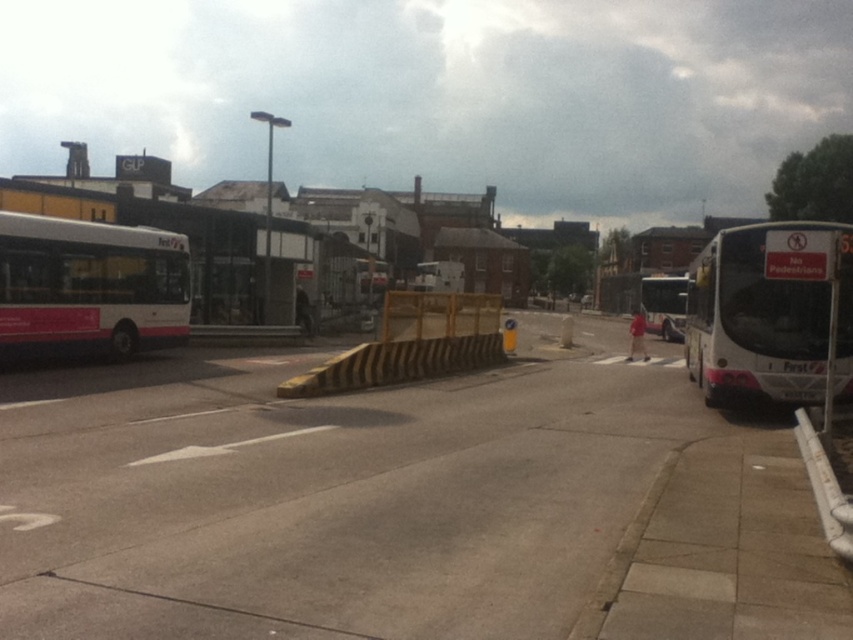
Between white glossy bus at right and white plastic curb at lower right, which one appears on the left side from the viewer's perspective?

Positioned to the left is white plastic curb at lower right.

Which is more to the right, white glossy bus at right or white plastic curb at lower right?

Positioned to the right is white glossy bus at right.

This screenshot has height=640, width=853. In order to click on white glossy bus at right in this screenshot , I will do `click(764, 321)`.

Does yellow striped plastic barricade at center have a greater height compared to white matte bus at center?

In fact, yellow striped plastic barricade at center may be shorter than white matte bus at center.

Who is taller, yellow striped plastic barricade at center or white matte bus at center?

white matte bus at center

Identify the location of yellow striped plastic barricade at center. This screenshot has width=853, height=640. (412, 344).

The height and width of the screenshot is (640, 853). Identify the location of yellow striped plastic barricade at center. (412, 344).

How much distance is there between white matte bus at left and white matte bus at center?

The distance of white matte bus at left from white matte bus at center is 30.37 meters.

Between white matte bus at left and white matte bus at center, which one appears on the right side from the viewer's perspective?

white matte bus at center

You are a GUI agent. You are given a task and a screenshot of the screen. Output one action in this format:
    pyautogui.click(x=<x>, y=<y>)
    Task: Click on the white matte bus at left
    The height and width of the screenshot is (640, 853).
    Given the screenshot: What is the action you would take?
    pyautogui.click(x=90, y=285)